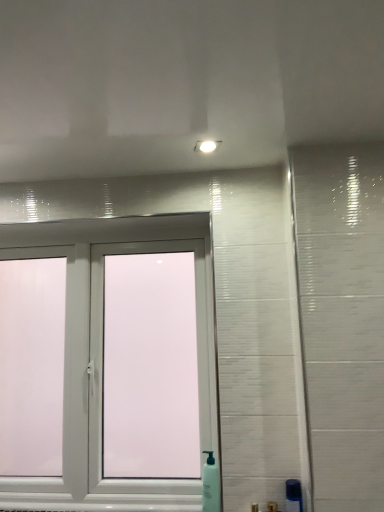
Question: Is white plastic soap dispenser at lower center, which is the 2th soap dispenser from right to left, inside the boundaries of white plastic window at center, or outside?

Choices:
 (A) outside
 (B) inside

Answer: (A)

Question: Looking at their shapes, would you say white plastic soap dispenser at lower center, positioned as the first soap dispenser in left-to-right order, is wider or thinner than white plastic window at center?

Choices:
 (A) wide
 (B) thin

Answer: (B)

Question: Which is farther from the white plastic window at center?

Choices:
 (A) green translucent soap dispenser at lower right, the second soap dispenser when ordered from back to front
 (B) white plastic soap dispenser at lower center, which is the 2th soap dispenser from right to left

Answer: (A)

Question: Which is nearer to the green translucent soap dispenser at lower right, marked as the first soap dispenser in a right-to-left arrangement?

Choices:
 (A) white plastic soap dispenser at lower center, placed as the second soap dispenser when sorted from front to back
 (B) white plastic window at center

Answer: (A)